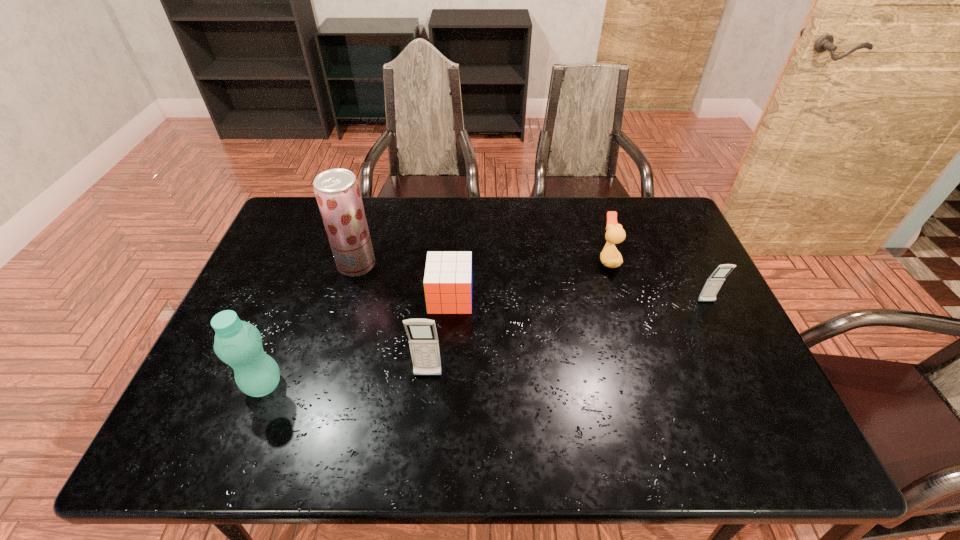
Where is `blank space located on the front-facing side of the shorter cellular telephone`? This screenshot has height=540, width=960. blank space located on the front-facing side of the shorter cellular telephone is located at coordinates (732, 356).

Where is `vacant area situated on the right of the fruit juice`? This screenshot has height=540, width=960. vacant area situated on the right of the fruit juice is located at coordinates (468, 265).

Find the location of a particular element. This screenshot has height=540, width=960. free space located 0.140m on the front of the cube is located at coordinates (446, 357).

In order to click on vacant space located on the beak of the duck in this screenshot , I will do `click(555, 260)`.

Identify the location of free space located on the beak of the duck. (525, 260).

The height and width of the screenshot is (540, 960). Find the location of `vacant space positioned 0.210m on the beak of the duck`. vacant space positioned 0.210m on the beak of the duck is located at coordinates (529, 260).

The height and width of the screenshot is (540, 960). What are the coordinates of `vacant point located 0.280m on the back of the bottle` in the screenshot? It's located at (303, 286).

Locate an element on the screen. This screenshot has width=960, height=540. cellular telephone that is at the near edge is located at coordinates (423, 340).

Locate an element on the screen. bottle situated at the near edge is located at coordinates tap(237, 343).

Locate an element on the screen. object located in the left edge section of the desktop is located at coordinates (237, 343).